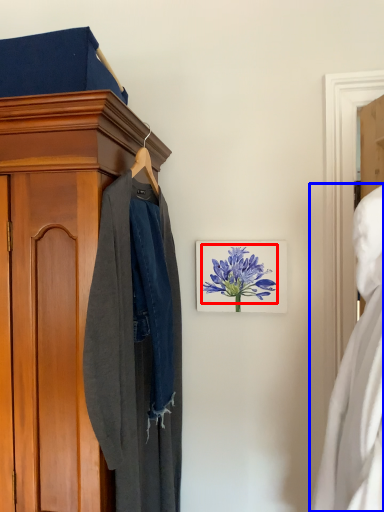
Question: Which object is closer to the camera taking this photo, flower (highlighted by a red box) or dress (highlighted by a blue box)?

Choices:
 (A) flower
 (B) dress

Answer: (B)